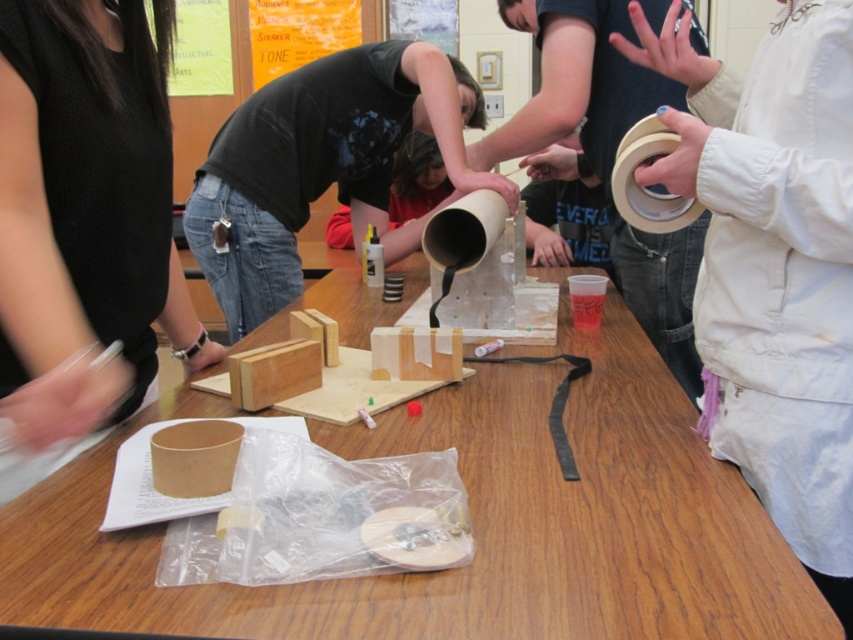
Locate an element on the screen. The image size is (853, 640). wooden table at center is located at coordinates (473, 524).

This screenshot has height=640, width=853. What do you see at coordinates (473, 524) in the screenshot?
I see `wooden table at center` at bounding box center [473, 524].

Locate an element on the screen. The image size is (853, 640). wooden table at center is located at coordinates (473, 524).